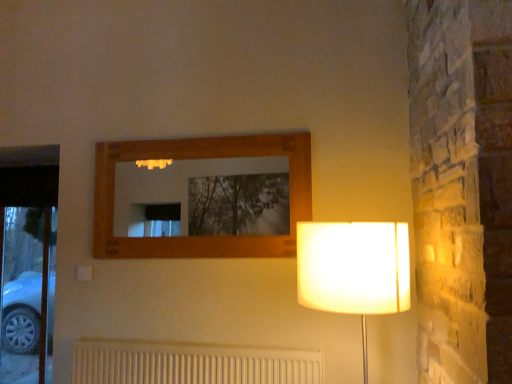
Question: Does white fabric lampshade at right turn towards white textured radiator at lower center?

Choices:
 (A) no
 (B) yes

Answer: (A)

Question: Is white fabric lampshade at right in contact with white textured radiator at lower center?

Choices:
 (A) yes
 (B) no

Answer: (B)

Question: Is white fabric lampshade at right positioned before white textured radiator at lower center?

Choices:
 (A) yes
 (B) no

Answer: (A)

Question: From the image's perspective, would you say white fabric lampshade at right is shown under white textured radiator at lower center?

Choices:
 (A) no
 (B) yes

Answer: (A)

Question: From a real-world perspective, is white fabric lampshade at right over white textured radiator at lower center?

Choices:
 (A) no
 (B) yes

Answer: (B)

Question: Is white fabric lampshade at right not near white textured radiator at lower center?

Choices:
 (A) yes
 (B) no

Answer: (B)

Question: Is white textured radiator at lower center completely or partially outside of white fabric lampshade at right?

Choices:
 (A) yes
 (B) no

Answer: (A)

Question: Is the surface of white textured radiator at lower center in direct contact with white fabric lampshade at right?

Choices:
 (A) no
 (B) yes

Answer: (A)

Question: Is white textured radiator at lower center thinner than white fabric lampshade at right?

Choices:
 (A) yes
 (B) no

Answer: (A)

Question: From a real-world perspective, is white textured radiator at lower center positioned over white fabric lampshade at right based on gravity?

Choices:
 (A) yes
 (B) no

Answer: (B)

Question: From a real-world perspective, does white textured radiator at lower center sit lower than white fabric lampshade at right?

Choices:
 (A) yes
 (B) no

Answer: (A)

Question: Does white textured radiator at lower center turn towards white fabric lampshade at right?

Choices:
 (A) no
 (B) yes

Answer: (A)

Question: Is point (93, 344) closer or farther from the camera than point (382, 271)?

Choices:
 (A) closer
 (B) farther

Answer: (B)